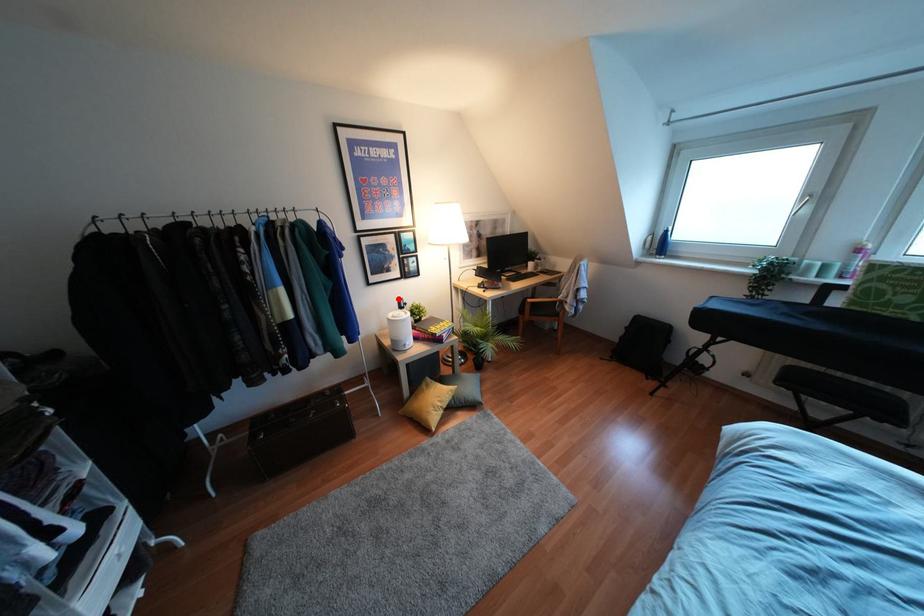
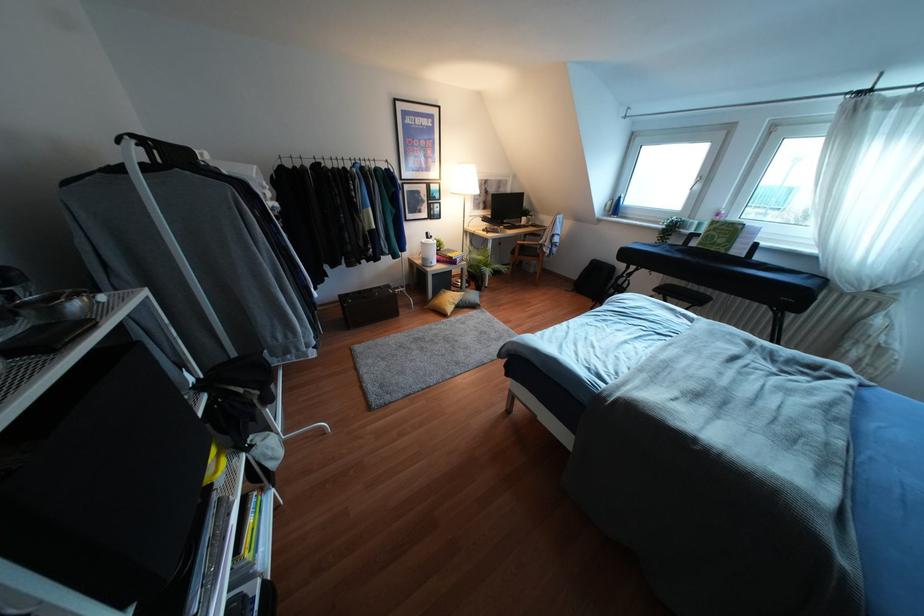
Question: I am providing you with two images of the same scene from different viewpoints. A red point is shown in image1. For the corresponding object point in image2, is it positioned nearer or farther from the camera?

Choices:
 (A) Nearer
 (B) Farther

Answer: (A)